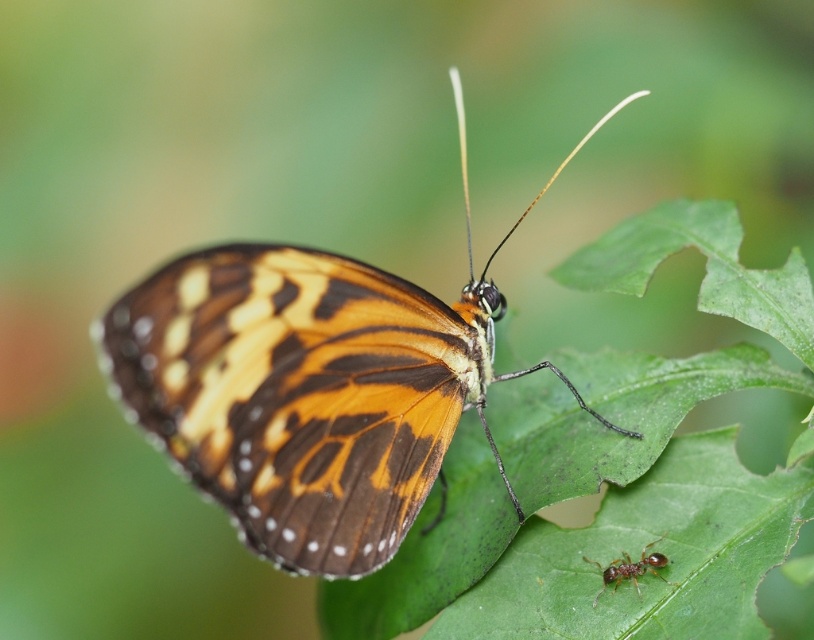
Does shiny orange butterfly at center appear on the left side of brown shiny ant at lower right?

Indeed, shiny orange butterfly at center is positioned on the left side of brown shiny ant at lower right.

Is shiny orange butterfly at center smaller than brown shiny ant at lower right?

Actually, shiny orange butterfly at center might be larger than brown shiny ant at lower right.

Which is behind, point (330, 422) or point (607, 570)?

Positioned behind is point (607, 570).

Locate an element on the screen. This screenshot has height=640, width=814. shiny orange butterfly at center is located at coordinates (309, 387).